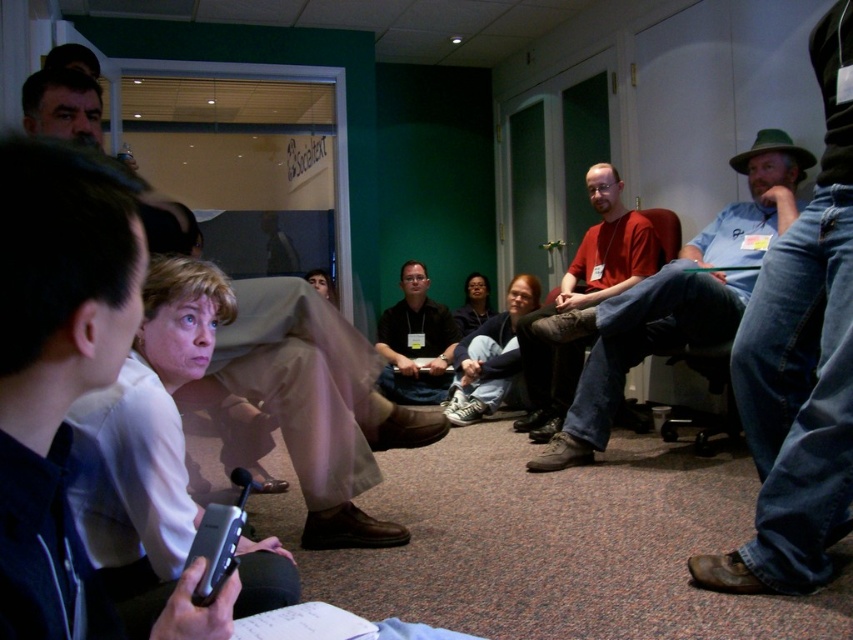
Question: Which object is closer to the camera taking this photo?

Choices:
 (A) white fabric shirt at upper left
 (B) red matte shirt at center

Answer: (A)

Question: Does blue jeans at lower right appear on the right side of red matte shirt at center?

Choices:
 (A) yes
 (B) no

Answer: (A)

Question: Can you confirm if white fabric shirt at upper left is positioned to the right of blue jeans at lower right?

Choices:
 (A) yes
 (B) no

Answer: (B)

Question: Which point is closer to the camera?

Choices:
 (A) (619, 307)
 (B) (401, 369)

Answer: (A)

Question: Can you confirm if blue jeans at lower right is positioned below light brown fabric pants at lower left?

Choices:
 (A) yes
 (B) no

Answer: (B)

Question: Considering the real-world distances, which object is farthest from the red shirt at center?

Choices:
 (A) white fabric shirt at upper left
 (B) light brown fabric pants at lower left
 (C) red matte shirt at center
 (D) blue jeans at lower right

Answer: (A)